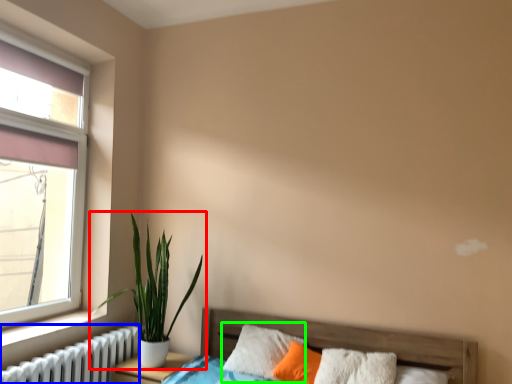
Question: Which object is positioned closest to houseplant (highlighted by a red box)? Select from radiator (highlighted by a blue box) and pillow (highlighted by a green box).

Choices:
 (A) radiator
 (B) pillow

Answer: (A)